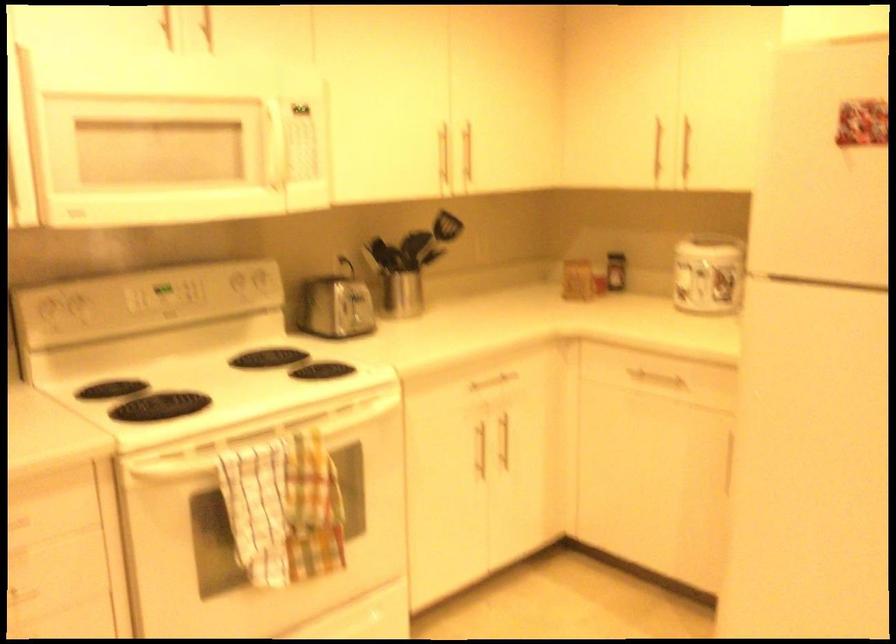
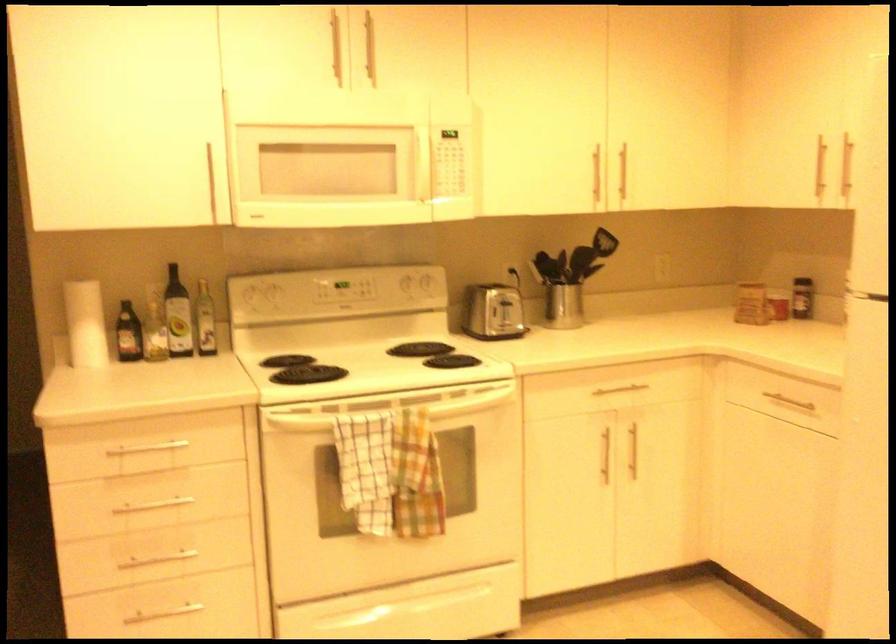
Where in the second image is the point corresponding to (x=616, y=270) from the first image?

(802, 298)